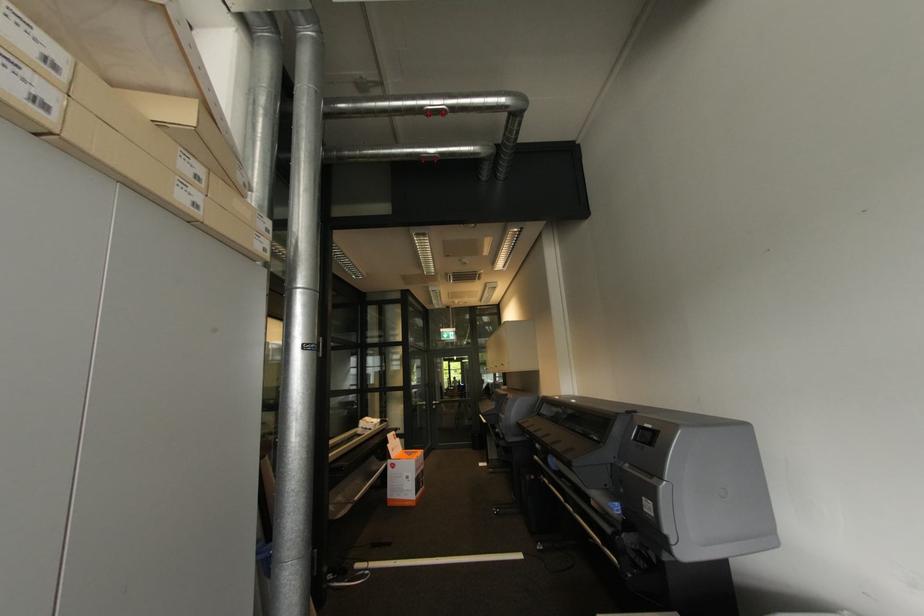
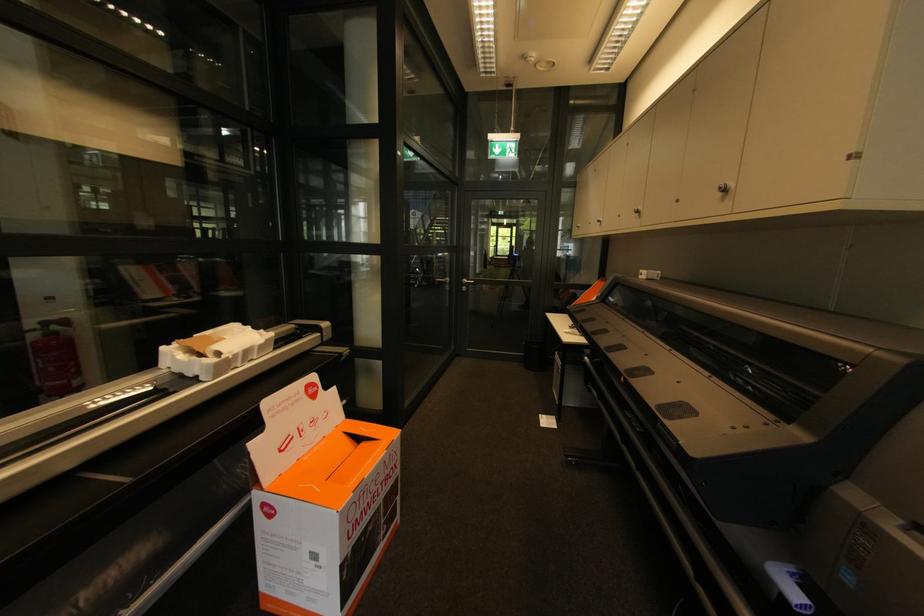
Locate, in the second image, the point that corresponds to point (371, 429) in the first image.

(195, 376)